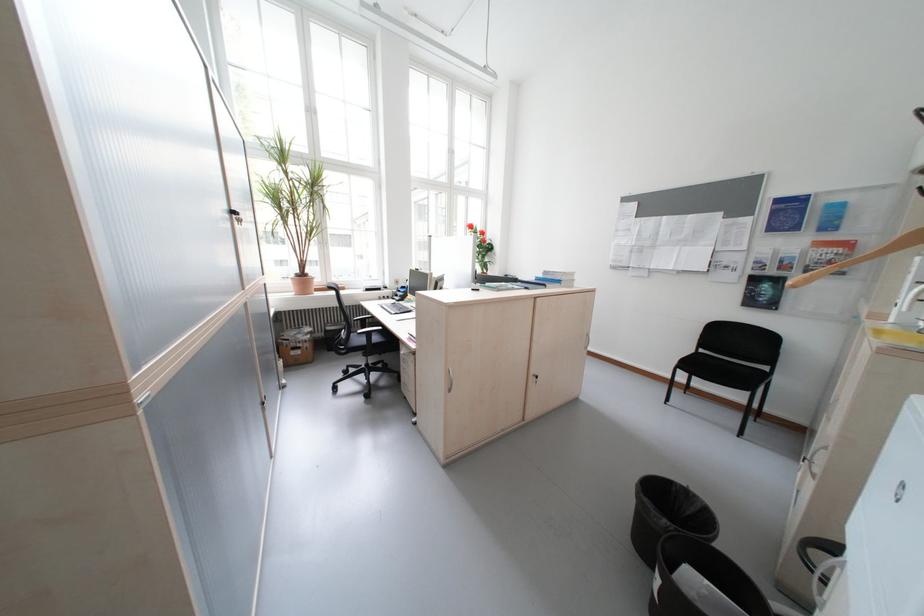
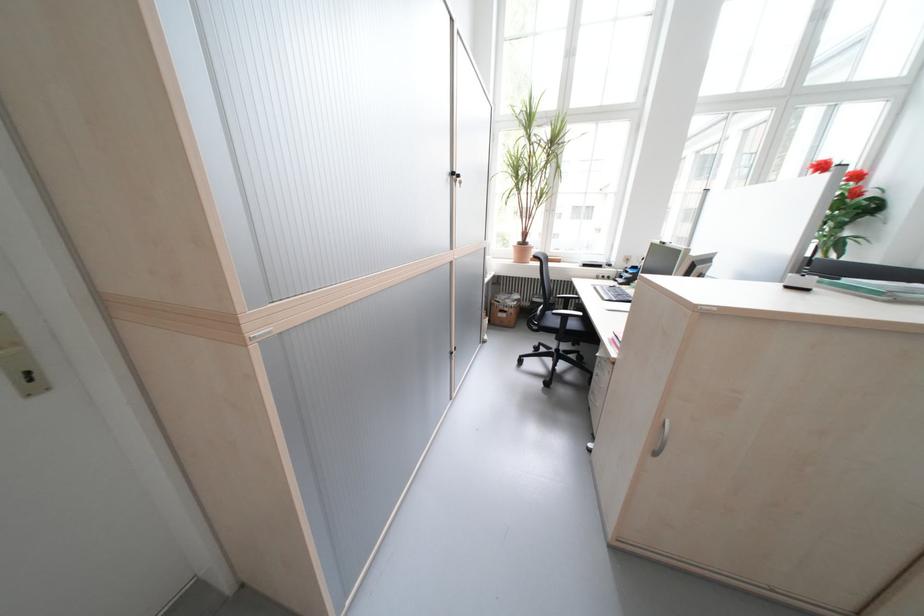
The point at (497,244) is marked in the first image. Where is the corresponding point in the second image?

(881, 196)